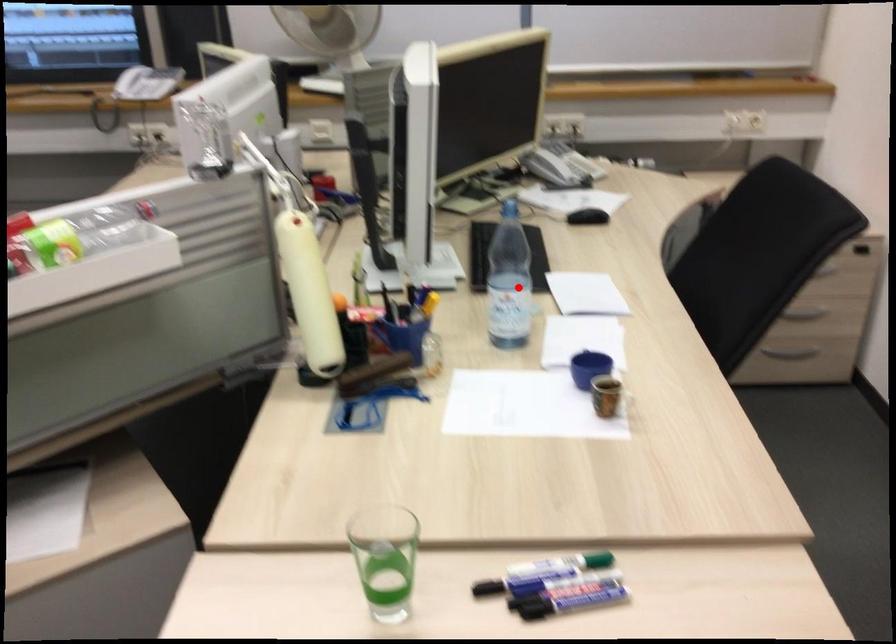
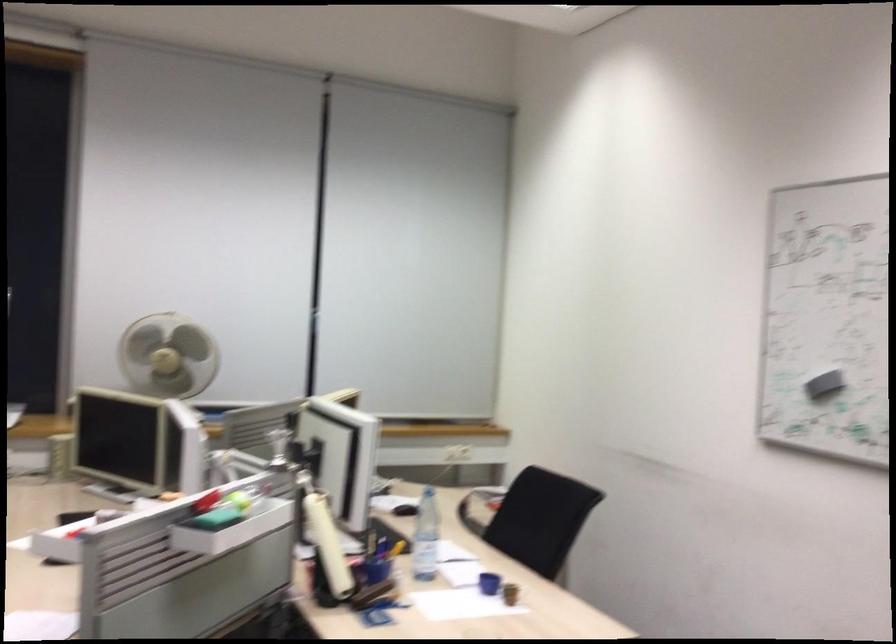
Question: I am providing you with two images of the same scene from different viewpoints. In image1, a red point is highlighted. Considering the same 3D point in image2, which of the following is correct?

Choices:
 (A) It is closer
 (B) It is farther

Answer: (B)